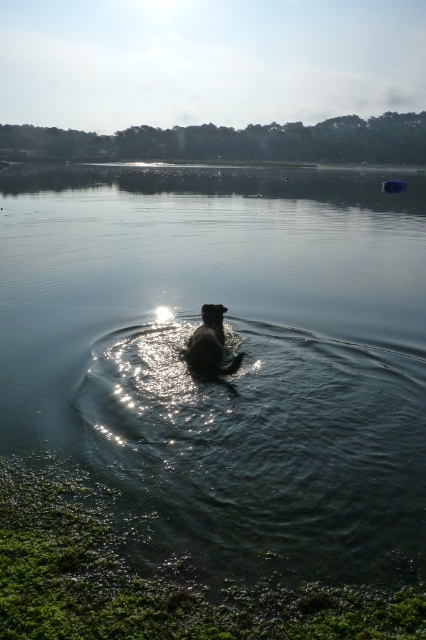
You are standing at the lakeside and want to take a photo of the shiny brown dog at center. To ensure the clear water at center is fully visible in the frame, should you zoom in or zoom out?

You should zoom out because the clear water at center might be wider than the shiny brown dog at center, so zooming out will capture both the dog and the wider area of water.

You are standing at the lakeside and want to take a photo of both the clear water at center and the shiny brown dog at center. Which object should you adjust your camera to focus on first if the dog is moving towards the left side?

You should focus on the shiny brown dog at center first because the clear water at center is positioned on the left side of the shiny brown dog at center, meaning the dog is currently to the right of the water. Since the dog is moving left, it will soon be closer to the water, so capturing it before it moves further left ensures a better shot.

You are standing on the lakeside and want to take a photo of both the clear water at center and the shiny brown dog at center. Which object should you focus on first if you want to capture both in sharp focus, considering their heights?

The clear water at center has a greater height compared to the shiny brown dog at center. To capture both in sharp focus, you should focus on the clear water at center first since it is taller and requires adjusting the camera settings for its height.